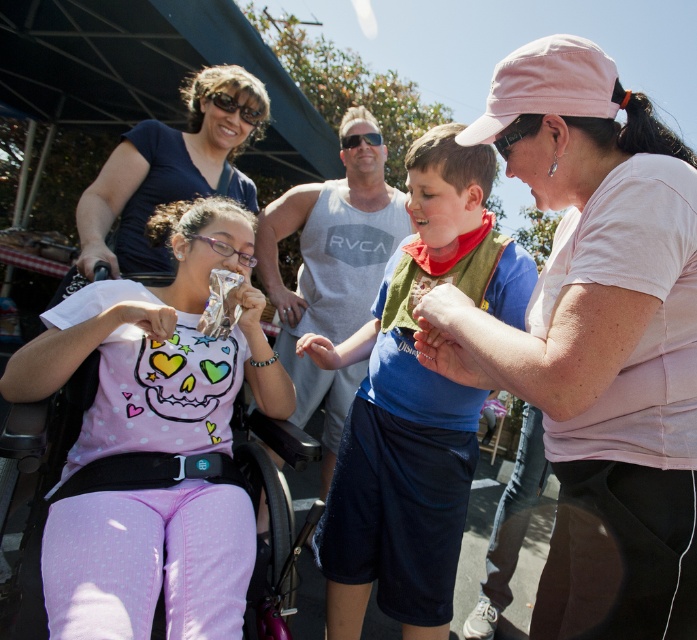
Can you confirm if pink cotton cap at upper right is shorter than blue cotton shirt at center?

Indeed, pink cotton cap at upper right has a lesser height compared to blue cotton shirt at center.

Can you confirm if pink cotton cap at upper right is positioned to the right of blue cotton shirt at center?

Yes, pink cotton cap at upper right is to the right of blue cotton shirt at center.

Does point (650, 332) come farther from viewer compared to point (444, 182)?

That is False.

Where is `pink cotton cap at upper right`? The height and width of the screenshot is (640, 697). pink cotton cap at upper right is located at coordinates (597, 340).

Who is positioned more to the left, pink cotton cap at upper right or pink matte shirt at center?

Positioned to the left is pink matte shirt at center.

Can you confirm if pink cotton cap at upper right is shorter than pink matte shirt at center?

In fact, pink cotton cap at upper right may be taller than pink matte shirt at center.

Identify the location of pink cotton cap at upper right. (597, 340).

Can you confirm if pink matte shirt at center is positioned to the left of matte blue shirt at upper left?

In fact, pink matte shirt at center is to the right of matte blue shirt at upper left.

Which is in front, point (176, 305) or point (167, 179)?

Point (176, 305)

Is point (144, 598) in front of point (137, 252)?

Yes, point (144, 598) is in front of point (137, 252).

Locate an element on the screen. This screenshot has width=697, height=640. pink matte shirt at center is located at coordinates (153, 440).